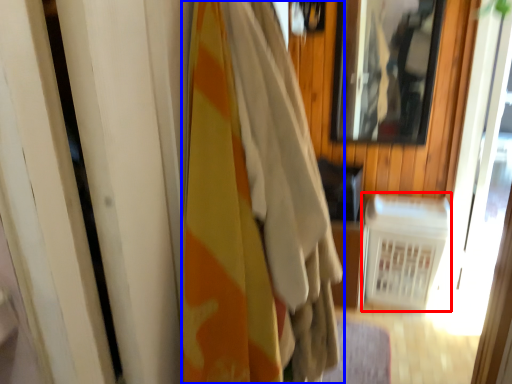
Question: Which object is further to the camera taking this photo, radiator (highlighted by a red box) or curtain (highlighted by a blue box)?

Choices:
 (A) radiator
 (B) curtain

Answer: (A)